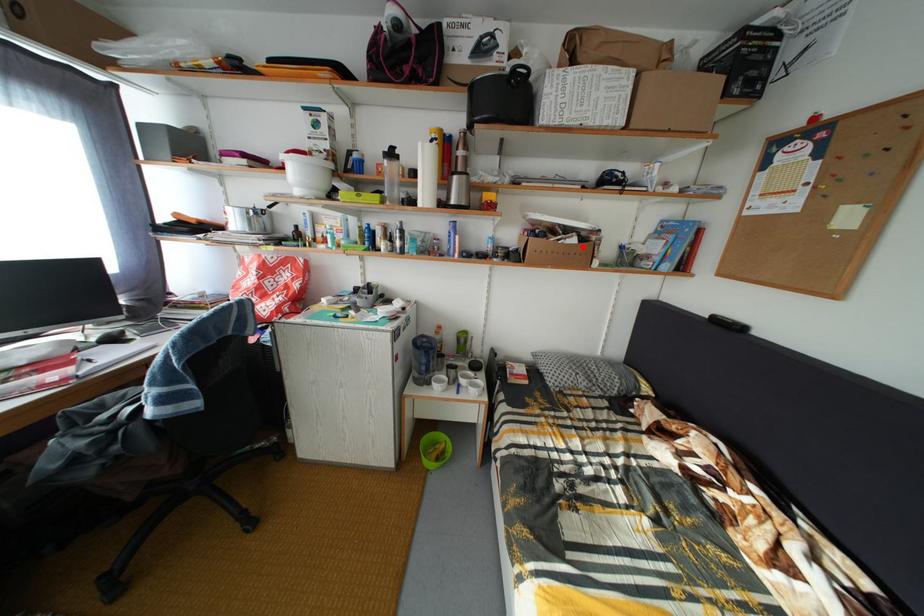
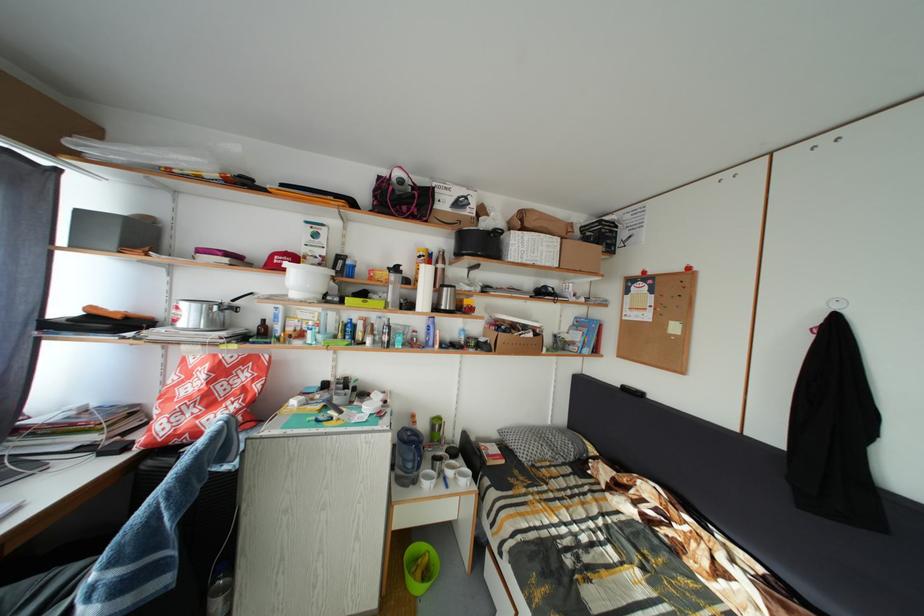
Find the pixel in the second image that matches the highlighted location in the first image.

(540, 341)